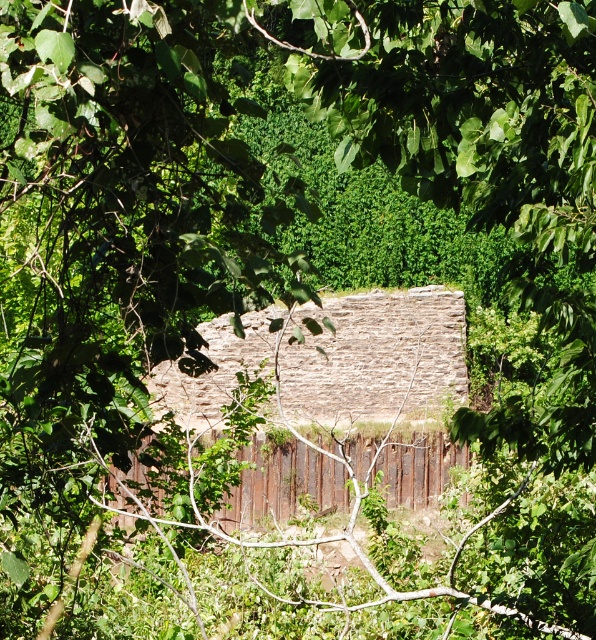
You are a painter standing at the base of the structure. You need to paint both the rustic stone hut at center and the rusty metal fence at center. Based on their positions, which one should you paint first without moving your position?

The rustic stone hut at center is located above the rusty metal fence at center, so you should paint the rusty metal fence at center first since it is lower and closer to your current position at the base.

Looking at this image, you are standing in front of the rustic stone hut at center and the rusty metal fence at center. Which object is closer to you?

The rustic stone hut at center is closer to you because the rusty metal fence at center is behind it.

Based on the photo, you are standing in front of the rustic stone structure. There is a point marked at coordinates (x=383, y=381). What does this point correspond to?

The point at coordinates (x=383, y=381) corresponds to the rustic stone hut at center.